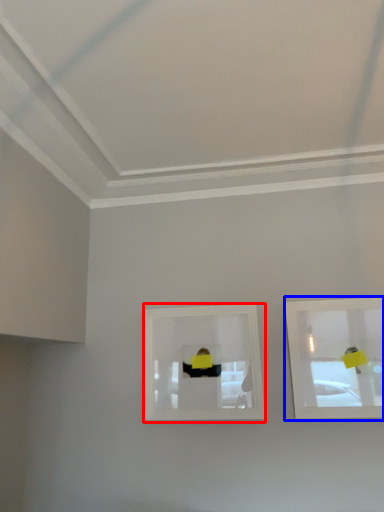
Question: Which of the following is the closest to the observer, picture frame (highlighted by a red box) or picture frame (highlighted by a blue box)?

Choices:
 (A) picture frame
 (B) picture frame

Answer: (B)